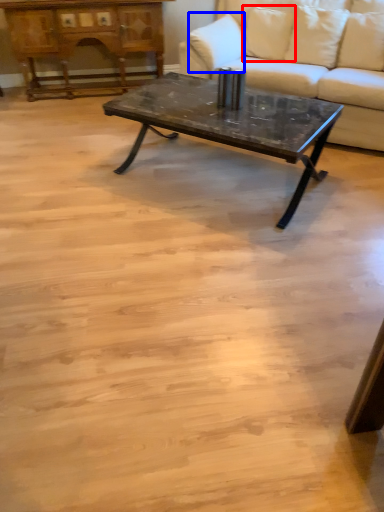
Question: Which object is closer to the camera taking this photo, pillow (highlighted by a red box) or pillow (highlighted by a blue box)?

Choices:
 (A) pillow
 (B) pillow

Answer: (B)